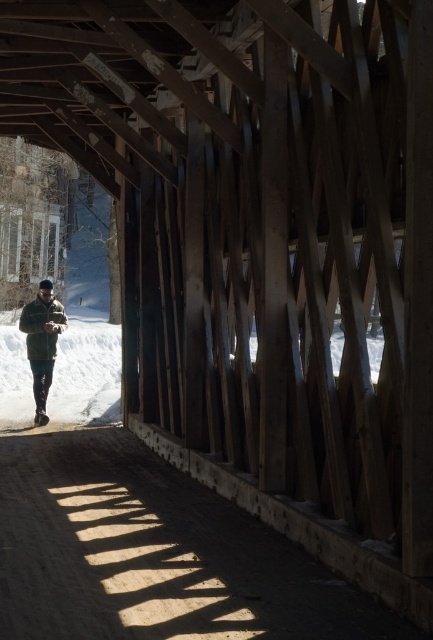
Question: Does white fluffy snow at center have a smaller size compared to camouflage jacket at center?

Choices:
 (A) yes
 (B) no

Answer: (B)

Question: Which point is closer to the camera?

Choices:
 (A) white fluffy snow at center
 (B) camouflage jacket at center

Answer: (B)

Question: Among these points, which one is farthest from the camera?

Choices:
 (A) (22, 348)
 (B) (287, 620)
 (C) (54, 356)

Answer: (A)

Question: Does white fluffy snow at center come in front of camouflage jacket at center?

Choices:
 (A) yes
 (B) no

Answer: (B)

Question: Can you confirm if smooth dirt path at center is bigger than camouflage jacket at center?

Choices:
 (A) yes
 (B) no

Answer: (B)

Question: Which object is positioned closest to the smooth dirt path at center?

Choices:
 (A) white fluffy snow at center
 (B) camouflage jacket at center

Answer: (B)